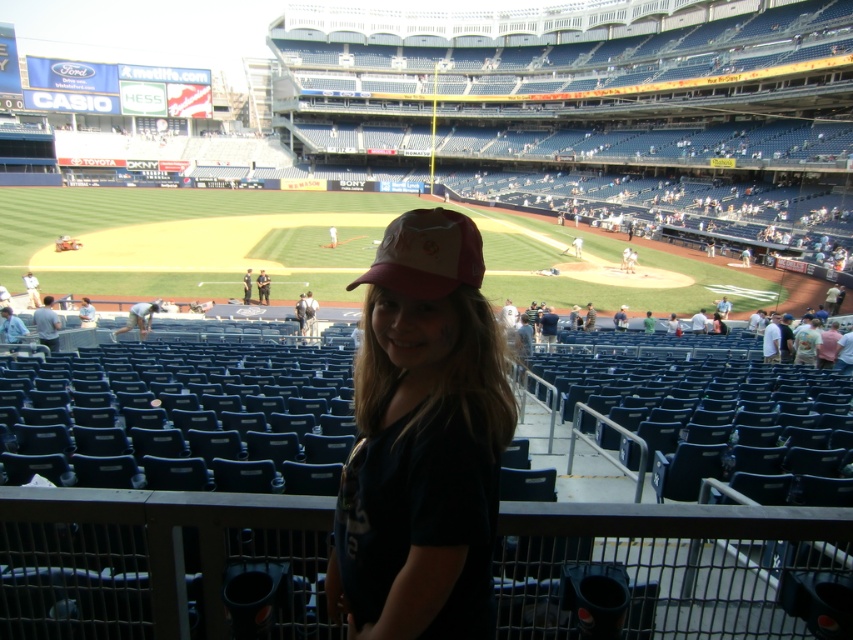
Does pink fabric cap at center have a lesser width compared to pink fabric baseball cap at center?

Incorrect, pink fabric cap at center's width is not less than pink fabric baseball cap at center's.

Can you confirm if pink fabric cap at center is shorter than pink fabric baseball cap at center?

Incorrect, pink fabric cap at center's height does not fall short of pink fabric baseball cap at center's.

This screenshot has height=640, width=853. I want to click on pink fabric cap at center, so click(x=422, y=440).